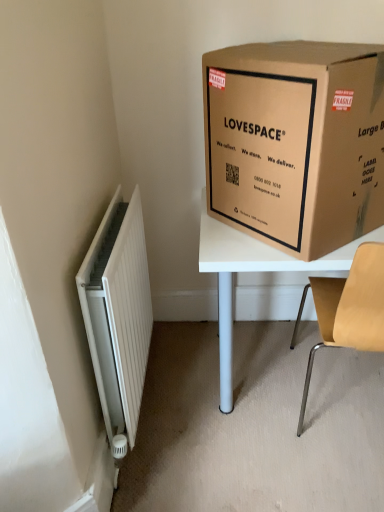
Question: Would you say white ribbed radiator at left is part of light brown wood chair at right's contents?

Choices:
 (A) yes
 (B) no

Answer: (B)

Question: From a real-world perspective, is light brown wood chair at right located higher than white ribbed radiator at left?

Choices:
 (A) no
 (B) yes

Answer: (A)

Question: Considering the relative sizes of light brown wood chair at right and white ribbed radiator at left in the image provided, is light brown wood chair at right thinner than white ribbed radiator at left?

Choices:
 (A) yes
 (B) no

Answer: (B)

Question: Is light brown wood chair at right directly adjacent to white ribbed radiator at left?

Choices:
 (A) no
 (B) yes

Answer: (A)

Question: Are light brown wood chair at right and white ribbed radiator at left far apart?

Choices:
 (A) no
 (B) yes

Answer: (A)

Question: From the image's perspective, is light brown wood chair at right above white ribbed radiator at left?

Choices:
 (A) no
 (B) yes

Answer: (A)

Question: From the image's perspective, is brown cardboard box at upper right on top of white ribbed radiator at left?

Choices:
 (A) yes
 (B) no

Answer: (A)

Question: Can you confirm if brown cardboard box at upper right is thinner than white ribbed radiator at left?

Choices:
 (A) no
 (B) yes

Answer: (A)

Question: Does brown cardboard box at upper right have a greater height compared to white ribbed radiator at left?

Choices:
 (A) yes
 (B) no

Answer: (B)

Question: Does brown cardboard box at upper right have a larger size compared to white ribbed radiator at left?

Choices:
 (A) yes
 (B) no

Answer: (A)

Question: Is the surface of brown cardboard box at upper right in direct contact with white ribbed radiator at left?

Choices:
 (A) no
 (B) yes

Answer: (A)

Question: Is the position of brown cardboard box at upper right less distant than that of white ribbed radiator at left?

Choices:
 (A) no
 (B) yes

Answer: (B)

Question: Can brown cardboard box at upper right be found inside light brown wood chair at right?

Choices:
 (A) no
 (B) yes

Answer: (A)